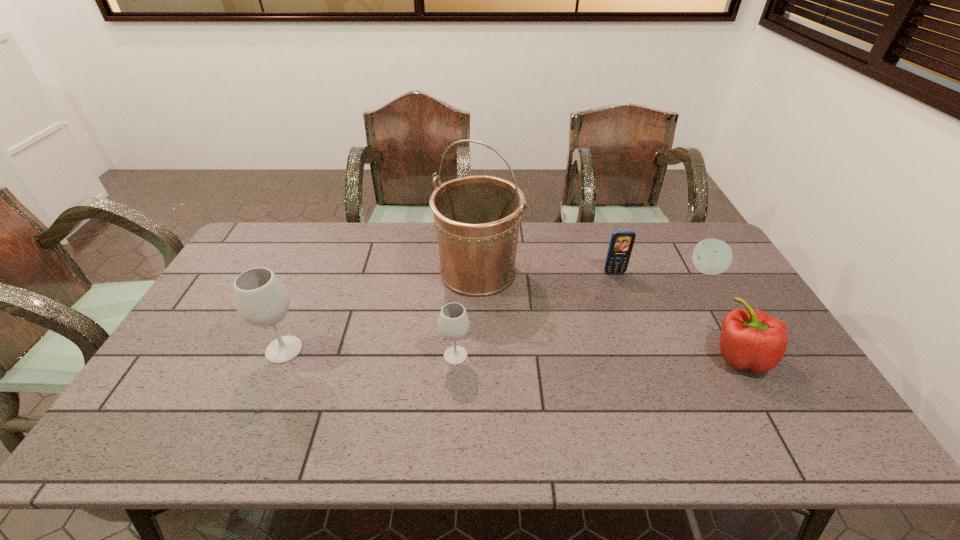
Find the location of a particular element. The height and width of the screenshot is (540, 960). vacant area situated 0.230m on the left of the apple is located at coordinates (621, 270).

This screenshot has width=960, height=540. I want to click on blank area located 0.280m on the front of the tallest object, so click(x=477, y=378).

The height and width of the screenshot is (540, 960). I want to click on free region located on the back of the bell pepper, so click(718, 316).

The height and width of the screenshot is (540, 960). Find the location of `apple situated at the far edge`. apple situated at the far edge is located at coordinates (711, 256).

You are a GUI agent. You are given a task and a screenshot of the screen. Output one action in this format:
    pyautogui.click(x=<x>, y=<y>)
    Task: Click on the bucket that is positioned at the far edge
    
    Given the screenshot: What is the action you would take?
    pyautogui.click(x=477, y=218)

At what (x,y) coordinates should I click in order to perform the action: click on apple present at the right edge. Please return your answer as a coordinate pair (x, y). Looking at the image, I should click on (711, 256).

I want to click on bell pepper at the right edge, so click(x=754, y=340).

At what (x,y) coordinates should I click in order to perform the action: click on object that is at the far right corner. Please return your answer as a coordinate pair (x, y). The image size is (960, 540). Looking at the image, I should click on (711, 256).

Image resolution: width=960 pixels, height=540 pixels. I want to click on vacant space at the far edge of the desktop, so click(549, 256).

Locate an element on the screen. free space at the near edge is located at coordinates (389, 410).